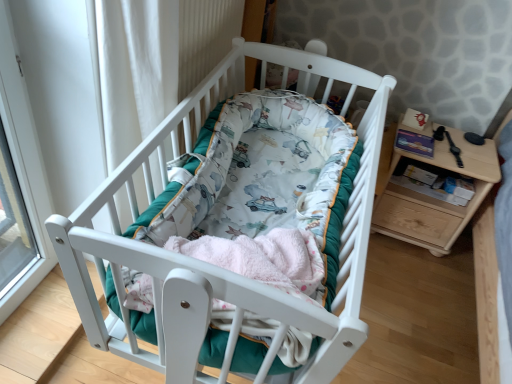
Question: From a real-world perspective, is fluffy pink blanket at center located higher than black leather watch at right?

Choices:
 (A) no
 (B) yes

Answer: (B)

Question: Considering the relative sizes of fluffy pink blanket at center and black leather watch at right in the image provided, is fluffy pink blanket at center bigger than black leather watch at right?

Choices:
 (A) no
 (B) yes

Answer: (B)

Question: From the image's perspective, is fluffy pink blanket at center located beneath black leather watch at right?

Choices:
 (A) yes
 (B) no

Answer: (A)

Question: From the image's perspective, is fluffy pink blanket at center on black leather watch at right?

Choices:
 (A) no
 (B) yes

Answer: (A)

Question: Is black leather watch at right inside fluffy pink blanket at center?

Choices:
 (A) yes
 (B) no

Answer: (B)

Question: Can you confirm if fluffy pink blanket at center is taller than black leather watch at right?

Choices:
 (A) no
 (B) yes

Answer: (B)

Question: Is fluffy pink blanket at center closer to camera compared to white wood crib at center?

Choices:
 (A) no
 (B) yes

Answer: (A)

Question: Are fluffy pink blanket at center and white wood crib at center located far from each other?

Choices:
 (A) no
 (B) yes

Answer: (A)

Question: Can you see fluffy pink blanket at center touching white wood crib at center?

Choices:
 (A) yes
 (B) no

Answer: (B)

Question: Considering the relative positions of fluffy pink blanket at center and white wood crib at center in the image provided, is fluffy pink blanket at center behind white wood crib at center?

Choices:
 (A) yes
 (B) no

Answer: (A)

Question: Would you say fluffy pink blanket at center contains white wood crib at center?

Choices:
 (A) yes
 (B) no

Answer: (B)

Question: Considering the relative positions of fluffy pink blanket at center and white wood crib at center in the image provided, is fluffy pink blanket at center to the right of white wood crib at center from the viewer's perspective?

Choices:
 (A) yes
 (B) no

Answer: (B)

Question: Considering the relative positions of black leather watch at right and white wood crib at center in the image provided, is black leather watch at right behind white wood crib at center?

Choices:
 (A) no
 (B) yes

Answer: (B)